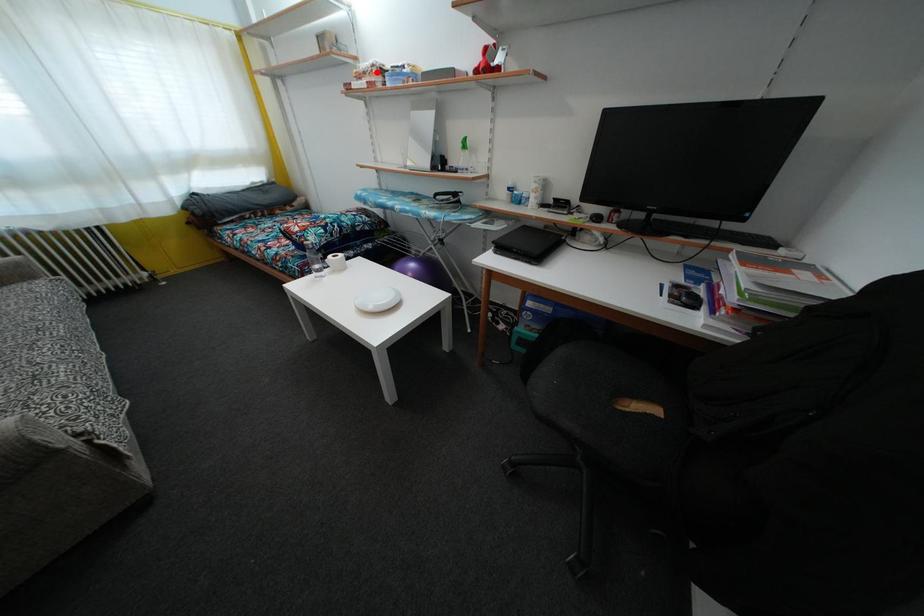
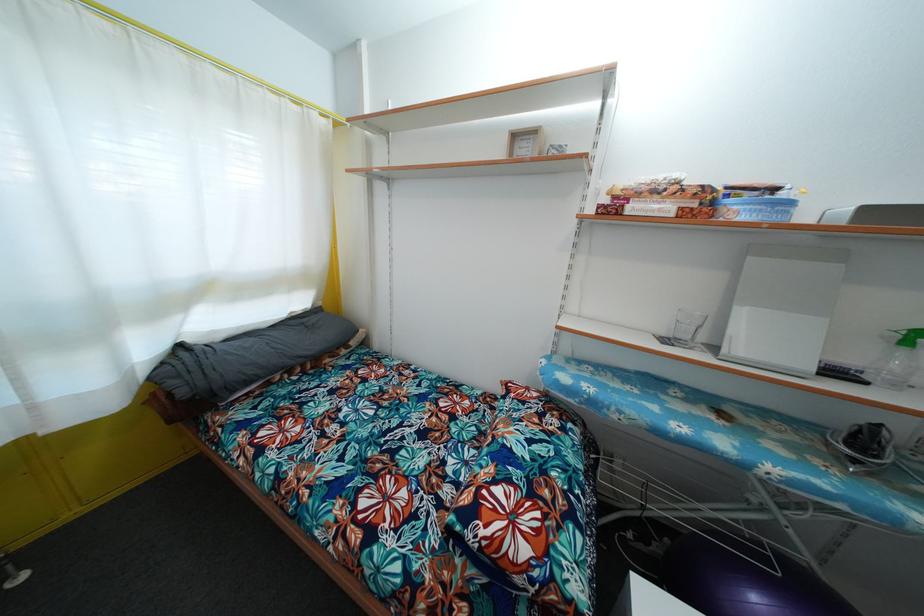
The point at the highlighted location is marked in the first image. Where is the corresponding point in the second image?

(683, 188)